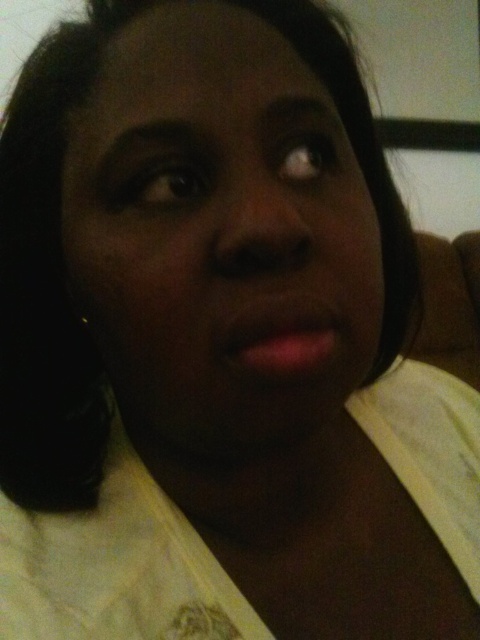
Does matte skin face at center appear on the left side of matte pink lips at center?

Indeed, matte skin face at center is positioned on the left side of matte pink lips at center.

Is point (273, 163) positioned behind point (298, 310)?

Yes, it is.

Who is more forward, [203,22] or [264,321]?

Point [264,321] is in front.

Where is `matte skin face at center`? The width and height of the screenshot is (480, 640). matte skin face at center is located at coordinates (219, 234).